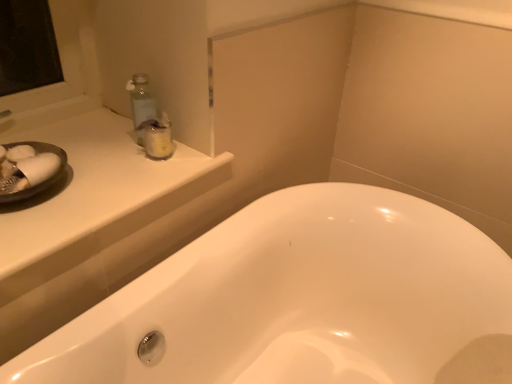
Question: Visually, is clear plastic jar at upper left positioned to the left or to the right of white glossy bathtub at center?

Choices:
 (A) right
 (B) left

Answer: (B)

Question: Considering the positions of clear plastic jar at upper left and white glossy bathtub at center in the image, is clear plastic jar at upper left wider or thinner than white glossy bathtub at center?

Choices:
 (A) wide
 (B) thin

Answer: (B)

Question: Which of these objects is positioned closest to the white glossy bathtub at center?

Choices:
 (A) clear plastic jar at upper left
 (B) white glossy counter top at upper left

Answer: (B)

Question: Which is farther from the white glossy bathtub at center?

Choices:
 (A) white glossy counter top at upper left
 (B) clear plastic jar at upper left

Answer: (B)